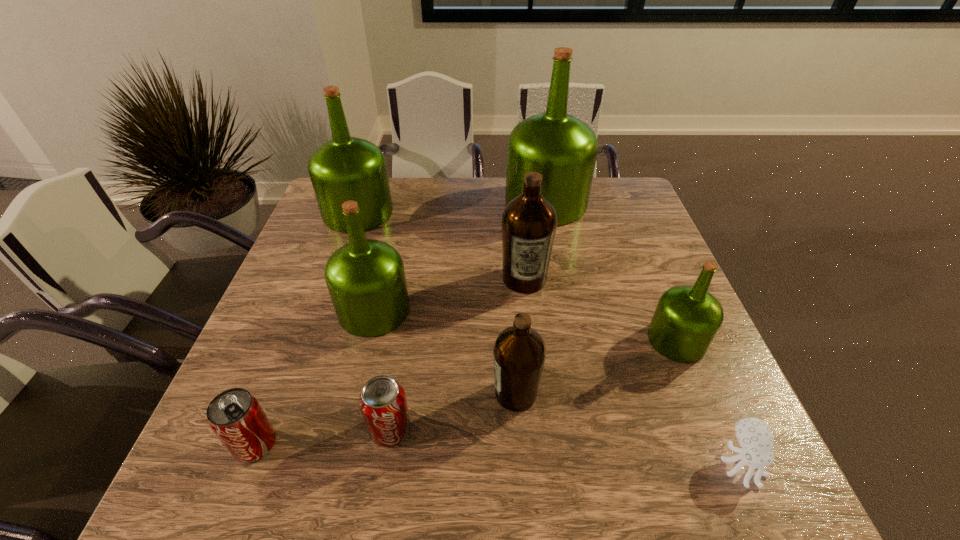
Identify the location of vacant space that's between the nearer brown olive oil and the third biggest green olive oil. (444, 352).

Image resolution: width=960 pixels, height=540 pixels. I want to click on vacant space that's between the rightmost green olive oil and the bigger brown olive oil, so click(600, 309).

Identify the location of vacant area that lies between the shortest object and the fifth shortest olive oil. This screenshot has width=960, height=540. (x=550, y=338).

The image size is (960, 540). In order to click on free space that is in between the right soda can and the third biggest green olive oil in this screenshot , I will do `click(382, 370)`.

Locate an element on the screen. Image resolution: width=960 pixels, height=540 pixels. free area in between the left soda can and the third biggest green olive oil is located at coordinates (315, 377).

The height and width of the screenshot is (540, 960). What are the coordinates of `free point between the left soda can and the rightmost green olive oil` in the screenshot? It's located at (466, 392).

The height and width of the screenshot is (540, 960). I want to click on object that is the seventh closest to the rightmost green olive oil, so pyautogui.click(x=345, y=168).

Identify the location of object that stands as the seventh closest to the second smallest green olive oil. The width and height of the screenshot is (960, 540). click(x=687, y=318).

The image size is (960, 540). What are the coordinates of `the second closest olive oil to the third smallest green olive oil` in the screenshot? It's located at (529, 222).

Where is `the second closest olive oil to the second smallest green olive oil`? The height and width of the screenshot is (540, 960). the second closest olive oil to the second smallest green olive oil is located at coordinates (345, 168).